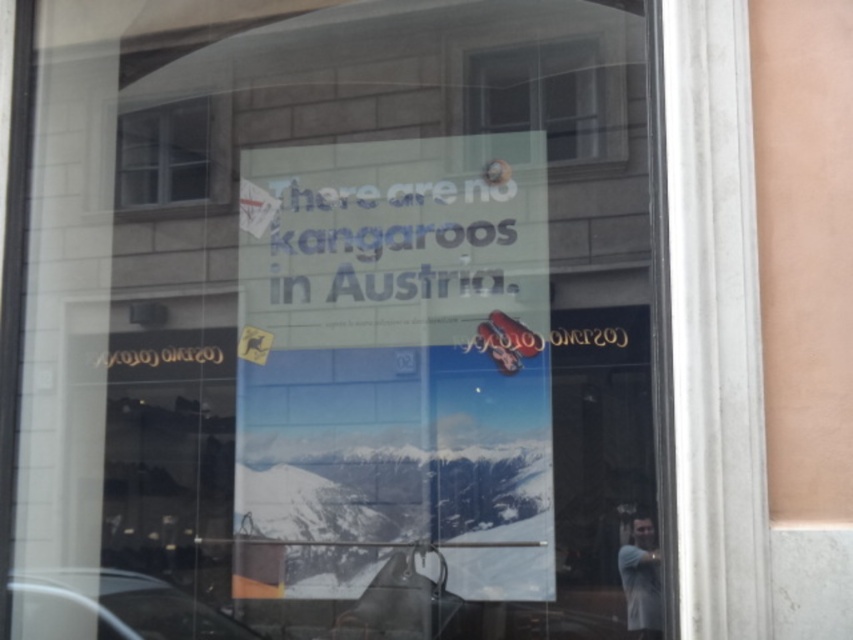
What is the spatial relationship between the transparent glass window at upper center and the gray fabric skier at lower right in the shop window display?

The transparent glass window at upper center is located to the left of the gray fabric skier at lower right.

You are a delivery person trying to see the outside through the white glass window at upper left and the gray fabric skier at lower right. Which object allows you to see more of the outside world?

The gray fabric skier at lower right allows you to see more of the outside world because it has a larger size compared to the white glass window at upper left.

You are standing outside the shop looking at the window display. There is a point marked at coordinates (550, 99) on the window. What object does this point correspond to?

The point corresponds to the transparent glass window at upper center.